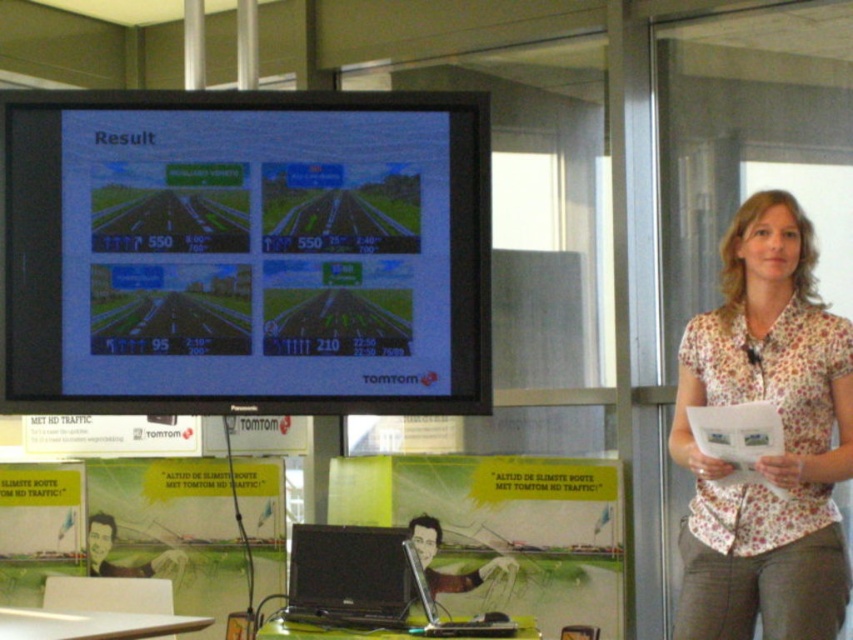
You are setting up for a presentation and need to place a 12 cm tall document holder between the matte black monitor at upper left and the black glossy laptop at center. Can the document holder fit vertically between them without blocking the screen?

The matte black monitor at upper left is taller than the black glossy laptop at center. Since the document holder is 12 cm tall, it can be placed vertically between them as long as there is enough horizontal space, but the height difference between the two devices might not affect vertical placement. However, ensure the placement doesn